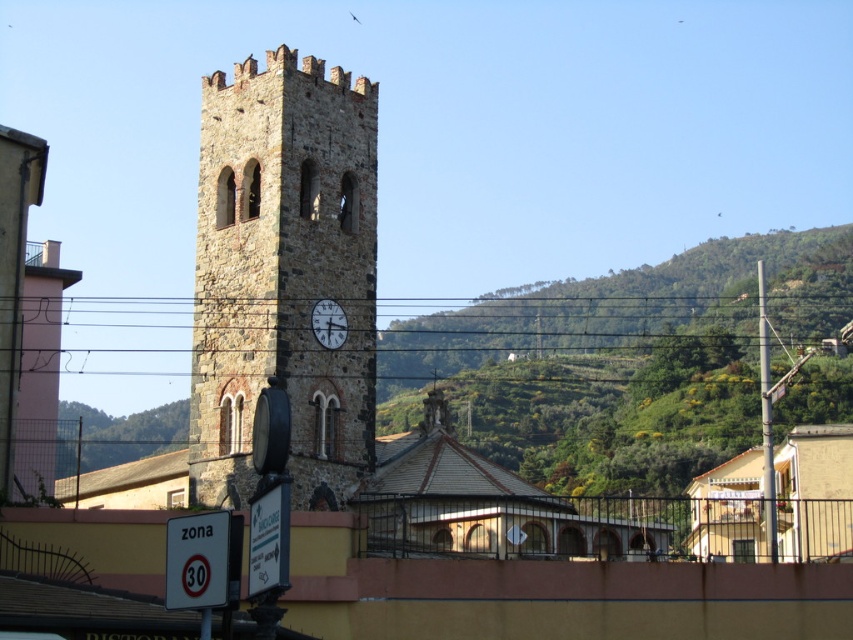
You are a tourist standing on the road near the stone clock tower at center and the matte stone clock at center. Which object is closer to your right side?

The matte stone clock at center is closer to your right side because the stone clock tower at center is to the left of it.

You are a delivery driver approaching the historic stone clock tower at center and the matte stone clock at center. Your truck has a 5.0 meter turning radius. Can you safely navigate around both objects without hitting them?

The distance between the stone clock tower at center and the matte stone stone clock at center is 5.50 meters. Since your truck requires a 5.0 meter turning radius, there is enough space to safely navigate around both objects without collision.

Looking at this image, you are a tourist standing at the road sign and looking at the historic stone tower. You notice both the stone clock tower at center and the matte stone clock at center. Which object is closer to you?

The matte stone clock at center is closer to you because the stone clock tower at center is positioned over it, meaning the matte stone clock is in front.